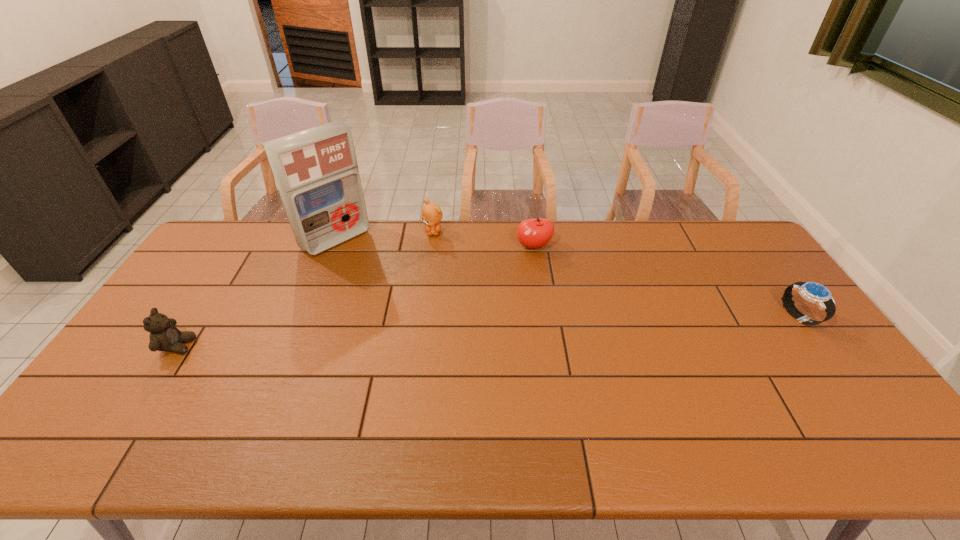
Identify the location of vacant space at the far right corner of the desktop. The height and width of the screenshot is (540, 960). (734, 247).

This screenshot has height=540, width=960. In order to click on free spot between the fourth object from right to left and the third object from left to right in this screenshot , I will do `click(385, 235)`.

The image size is (960, 540). What are the coordinates of `empty space that is in between the shortest object and the leftmost object` in the screenshot? It's located at (489, 332).

The width and height of the screenshot is (960, 540). I want to click on free point between the fourth object from right to left and the apple, so click(435, 243).

Where is `empty space that is in between the right teddy bear and the leftmost object`? Image resolution: width=960 pixels, height=540 pixels. empty space that is in between the right teddy bear and the leftmost object is located at coordinates (305, 289).

Find the location of a particular element. The height and width of the screenshot is (540, 960). vacant space in between the right teddy bear and the fourth object from left to right is located at coordinates (484, 239).

This screenshot has height=540, width=960. Find the location of `empty space between the shortest object and the leftmost object`. empty space between the shortest object and the leftmost object is located at coordinates (489, 332).

This screenshot has width=960, height=540. What are the coordinates of `free space between the tallest object and the left teddy bear` in the screenshot? It's located at (256, 293).

This screenshot has height=540, width=960. I want to click on vacant area between the right teddy bear and the first-aid kit, so click(x=385, y=235).

Find the location of `vacant point located between the watch and the apple`. vacant point located between the watch and the apple is located at coordinates (666, 282).